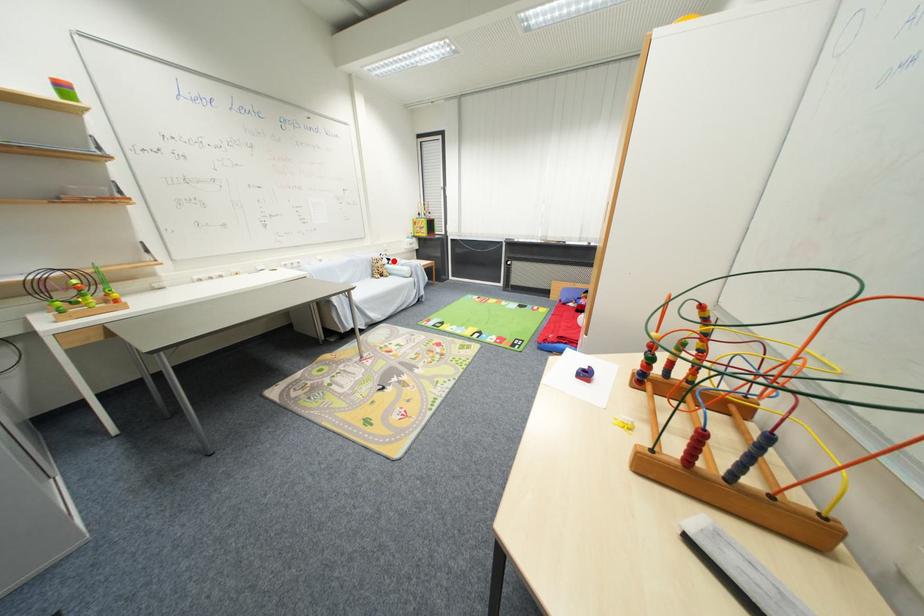
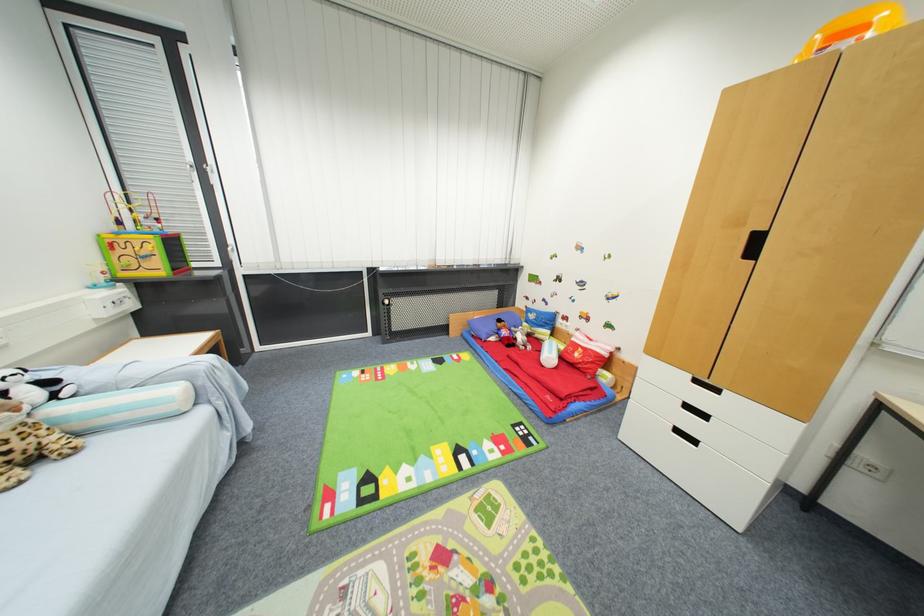
Question: I am providing you with two images of the same scene from different viewpoints. Given a red point in image1, look at the same physical point in image2. Is it:

Choices:
 (A) Closer to the viewpoint
 (B) Farther from the viewpoint

Answer: (B)